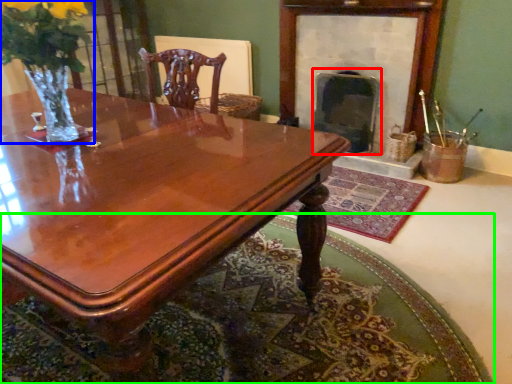
Question: Based on their relative distances, which object is nearer to fireplace (highlighted by a red box)? Choose from floral arrangement (highlighted by a blue box) and mat (highlighted by a green box).

Choices:
 (A) floral arrangement
 (B) mat

Answer: (B)